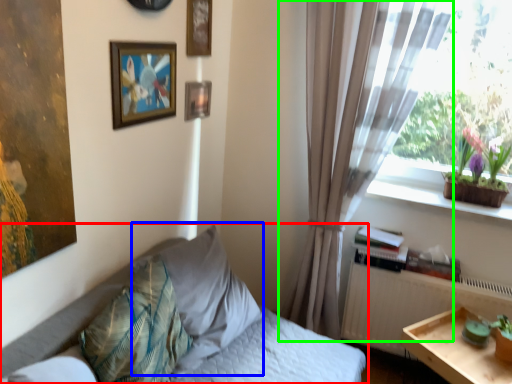
Question: Considering the real-world distances, which object is closest to bed (highlighted by a red box)? pillow (highlighted by a blue box) or curtain (highlighted by a green box).

Choices:
 (A) pillow
 (B) curtain

Answer: (A)